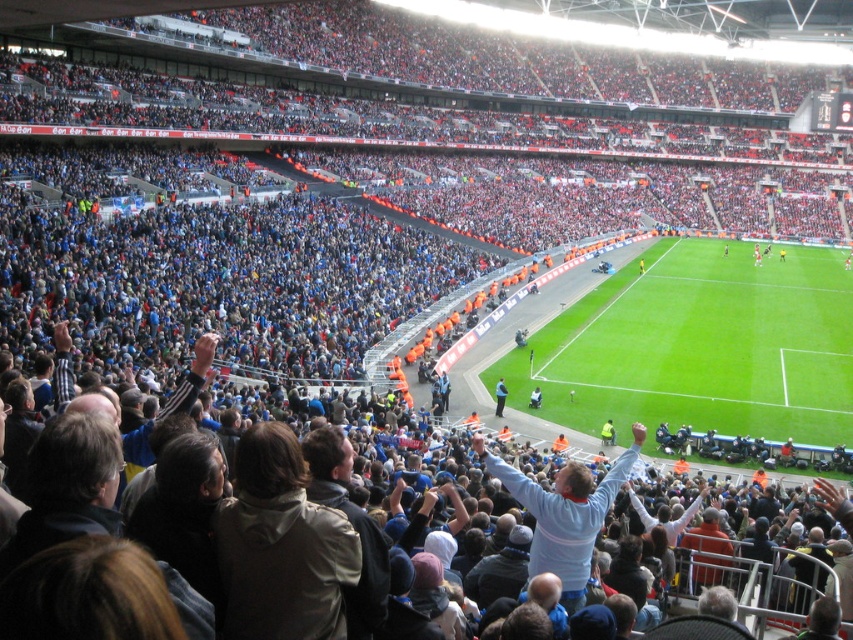
Describe the element at coordinates (701, 346) in the screenshot. This screenshot has width=853, height=640. I see `green grass football field at center` at that location.

Who is more forward, (805, 326) or (566, 540)?

Point (566, 540) is more forward.

Locate an element on the screen. The height and width of the screenshot is (640, 853). green grass football field at center is located at coordinates (701, 346).

Identify the location of green grass football field at center. Image resolution: width=853 pixels, height=640 pixels. (701, 346).